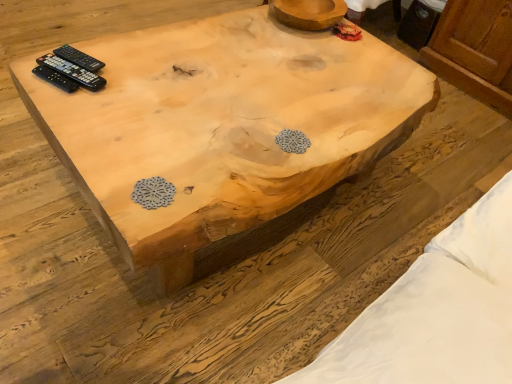
This screenshot has width=512, height=384. I want to click on free space on the front side of black plastic remote control at upper left, arranged as the 3th remote control when viewed from the front, so click(x=69, y=95).